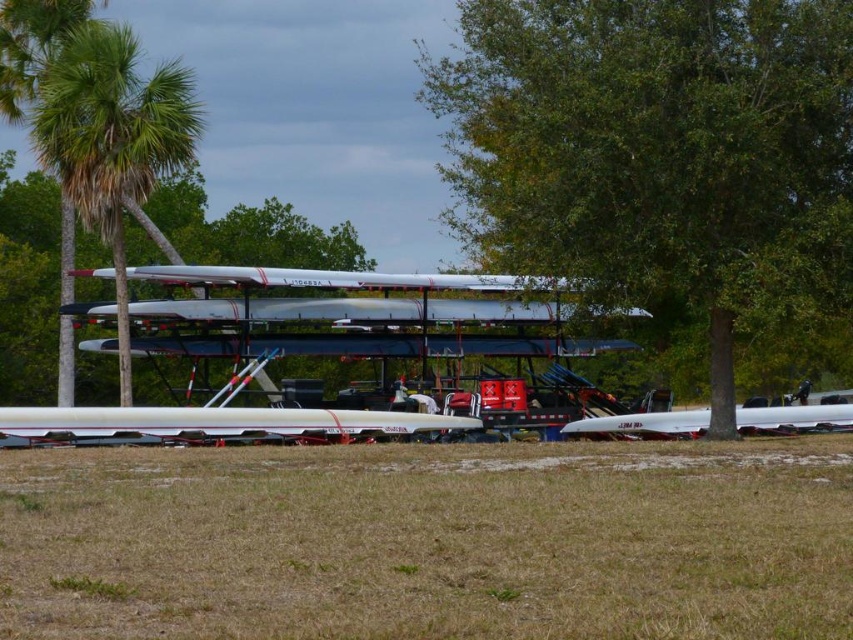
Who is lower down, green leafy tree at center or white matte boat at lower right?

white matte boat at lower right is below.

Can you confirm if green leafy tree at center is taller than white matte boat at lower right?

Yes, green leafy tree at center is taller than white matte boat at lower right.

At what (x,y) coordinates should I click in order to perform the action: click on green leafy tree at center. Please return your answer as a coordinate pair (x, y). The image size is (853, 640). Looking at the image, I should click on (656, 150).

From the picture: Between green leafy tree at center and white glossy rowboat at lower center, which one is positioned higher?

green leafy tree at center is higher up.

Is point (694, 33) closer to viewer compared to point (387, 433)?

Yes, it is.

Image resolution: width=853 pixels, height=640 pixels. What are the coordinates of `green leafy tree at center` in the screenshot? It's located at (656, 150).

Can you confirm if green leafy palm tree at left is positioned to the right of white glossy rowboat at lower center?

In fact, green leafy palm tree at left is to the left of white glossy rowboat at lower center.

Is green leafy palm tree at left closer to camera compared to white glossy rowboat at lower center?

That is False.

Who is more distant from viewer, (62,132) or (233,410)?

Positioned behind is point (62,132).

The width and height of the screenshot is (853, 640). In order to click on green leafy palm tree at left in this screenshot , I will do `click(112, 138)`.